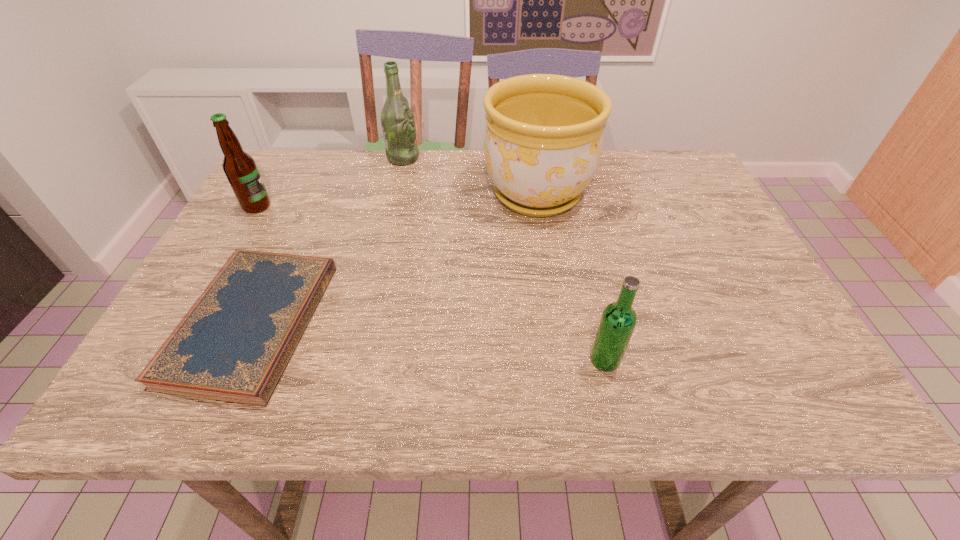
I want to click on the farthest beer bottle, so click(397, 119).

I want to click on the third object from right to left, so click(397, 119).

You are a GUI agent. You are given a task and a screenshot of the screen. Output one action in this format:
    pyautogui.click(x=<x>, y=<y>)
    Task: Click on the flowerpot
    This screenshot has height=540, width=960.
    Given the screenshot: What is the action you would take?
    pyautogui.click(x=543, y=140)

Find the location of `the second farthest beer bottle`. the second farthest beer bottle is located at coordinates (239, 167).

Find the location of a particular element. The image size is (960, 540). the rightmost beer bottle is located at coordinates (618, 320).

Find the location of a particular element. the shortest beer bottle is located at coordinates (618, 320).

The height and width of the screenshot is (540, 960). In order to click on paperback book in this screenshot , I will do `click(235, 342)`.

Locate an element on the screen. The image size is (960, 540). vacant space located 0.230m on the surface of the farthest beer bottle is located at coordinates (497, 158).

The image size is (960, 540). I want to click on free spot located 0.330m on the left of the flowerpot, so [359, 194].

Image resolution: width=960 pixels, height=540 pixels. I want to click on free space located 0.190m on the label of the second farthest beer bottle, so click(x=344, y=206).